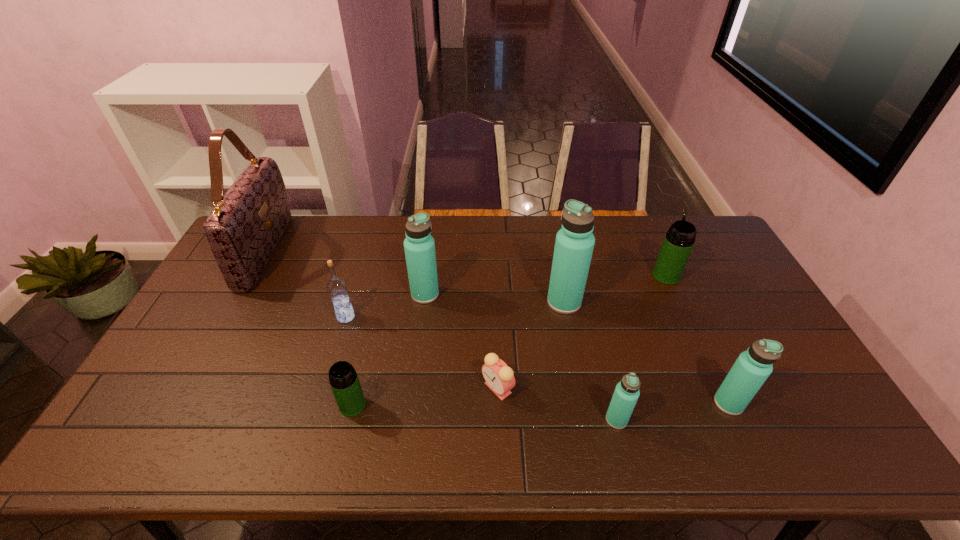
Identify the location of vacant region located from the spout of the right green thermos bottle. (651, 243).

The width and height of the screenshot is (960, 540). Identify the location of free space located from the spout of the right green thermos bottle. (647, 235).

Locate an element on the screen. vacant space positioned on the left of the rightmost aqua thermos bottle is located at coordinates (633, 403).

At what (x,y) coordinates should I click in order to perform the action: click on free location located 0.080m on the right of the blue vodka. Please return your answer as a coordinate pair (x, y). Looking at the image, I should click on (381, 317).

Image resolution: width=960 pixels, height=540 pixels. Find the location of `vacant area located 0.090m from the spout of the smaller green thermos bottle`. vacant area located 0.090m from the spout of the smaller green thermos bottle is located at coordinates (342, 452).

Identify the location of free spot located on the right of the smallest aqua thermos bottle. This screenshot has height=540, width=960. (724, 420).

At what (x,y) coordinates should I click in order to perform the action: click on vacant region located 0.170m on the face of the fifth object from left to right. Please return your answer as a coordinate pair (x, y). The height and width of the screenshot is (540, 960). Looking at the image, I should click on (417, 388).

In order to click on free spot located on the face of the fifth object from left to right in this screenshot , I will do `click(329, 388)`.

In order to click on vacant space located 0.150m on the face of the fifth object from left to right in this screenshot , I will do `click(424, 388)`.

This screenshot has width=960, height=540. Identify the location of object located in the far edge section of the desktop. (243, 229).